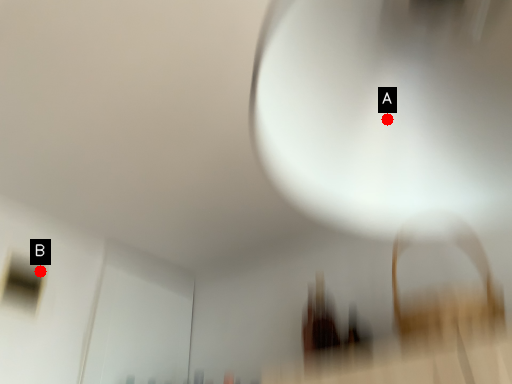
Question: Two points are circled on the image, labeled by A and B beside each circle. Which point is closer to the camera taking this photo?

Choices:
 (A) A is closer
 (B) B is closer

Answer: (A)